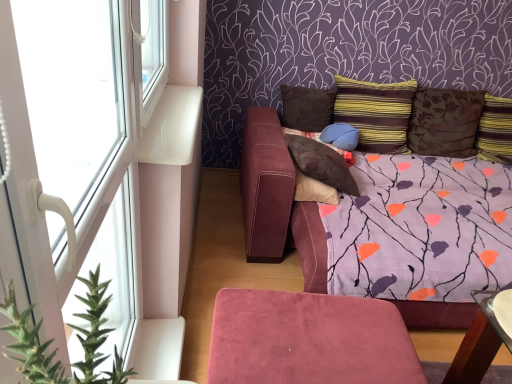
Question: From the image's perspective, is white plastic window at upper left, which is the 2th window from bottom to top, on matte blue pillow at center, the 3th pillow viewed from the left?

Choices:
 (A) no
 (B) yes

Answer: (B)

Question: From the image's perspective, is white plastic window at upper left, placed as the first window when sorted from top to bottom, below matte blue pillow at center, the 3th pillow viewed from the left?

Choices:
 (A) no
 (B) yes

Answer: (A)

Question: Is white plastic window at upper left, placed as the first window when sorted from top to bottom, not close to matte blue pillow at center, which is counted as the fourth pillow, starting from the right?

Choices:
 (A) yes
 (B) no

Answer: (A)

Question: Is white plastic window at upper left, which is the 2th window from bottom to top, smaller than matte blue pillow at center, which is counted as the fourth pillow, starting from the right?

Choices:
 (A) yes
 (B) no

Answer: (B)

Question: Considering the relative sizes of white plastic window at upper left, placed as the first window when sorted from top to bottom, and matte blue pillow at center, the 3th pillow viewed from the left, in the image provided, is white plastic window at upper left, placed as the first window when sorted from top to bottom, thinner than matte blue pillow at center, the 3th pillow viewed from the left,?

Choices:
 (A) no
 (B) yes

Answer: (B)

Question: Are white plastic window at upper left, which is the 2th window from bottom to top, and matte blue pillow at center, which is counted as the fourth pillow, starting from the right, making contact?

Choices:
 (A) yes
 (B) no

Answer: (B)

Question: From the image's perspective, is brown suede pillow at upper center, the 2th pillow positioned from the left, located above suede ottoman at lower center?

Choices:
 (A) yes
 (B) no

Answer: (A)

Question: Considering the relative sizes of brown suede pillow at upper center, which appears as the 5th pillow when viewed from the right, and suede ottoman at lower center in the image provided, is brown suede pillow at upper center, which appears as the 5th pillow when viewed from the right, thinner than suede ottoman at lower center?

Choices:
 (A) yes
 (B) no

Answer: (A)

Question: From a real-world perspective, is brown suede pillow at upper center, the 2th pillow positioned from the left, under suede ottoman at lower center?

Choices:
 (A) yes
 (B) no

Answer: (B)

Question: Can you confirm if brown suede pillow at upper center, which appears as the 5th pillow when viewed from the right, is bigger than suede ottoman at lower center?

Choices:
 (A) yes
 (B) no

Answer: (B)

Question: Is brown suede pillow at upper center, which appears as the 5th pillow when viewed from the right, facing away from suede ottoman at lower center?

Choices:
 (A) yes
 (B) no

Answer: (B)

Question: Could you tell me if brown suede pillow at upper center, the 2th pillow positioned from the left, is turned towards suede ottoman at lower center?

Choices:
 (A) no
 (B) yes

Answer: (B)

Question: From the image's perspective, is brown textured pillow at upper right, which appears as the 2th pillow when viewed from the right, beneath white plastic window at upper left, placed as the first window when sorted from top to bottom?

Choices:
 (A) no
 (B) yes

Answer: (B)